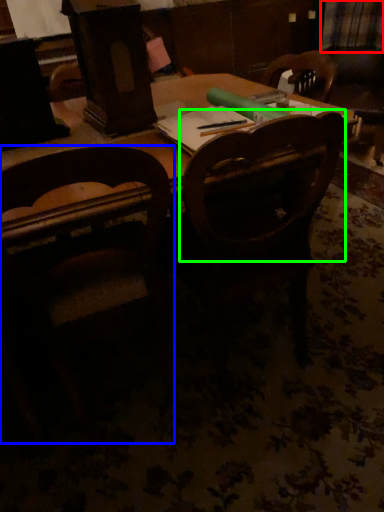
Question: Which object is the closest to the plaid (highlighted by a red box)? Choose among these: chair (highlighted by a blue box) or chair (highlighted by a green box).

Choices:
 (A) chair
 (B) chair

Answer: (B)